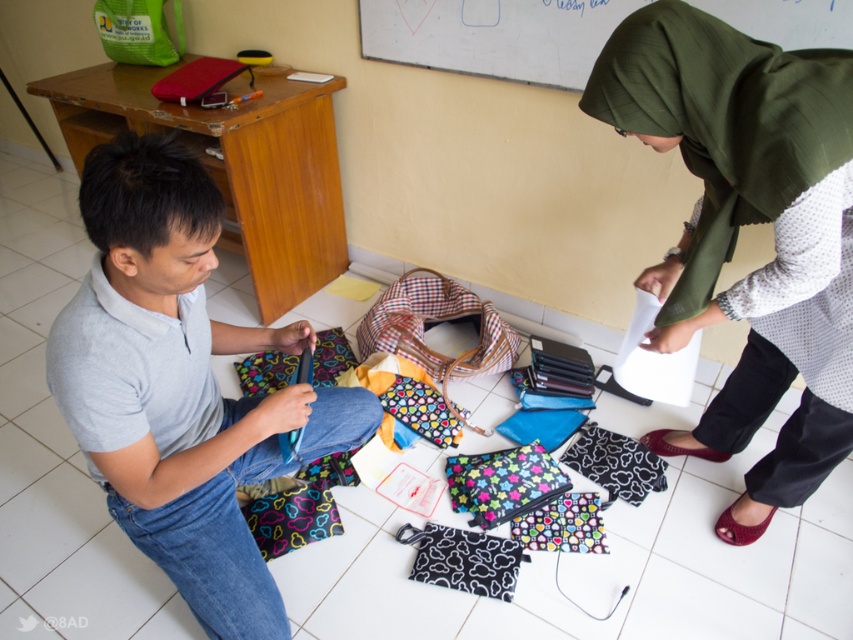
Is green fabric hijab at upper right bigger than gray matte shirt at center?

Correct, green fabric hijab at upper right is larger in size than gray matte shirt at center.

Can you confirm if green fabric hijab at upper right is positioned above gray matte shirt at center?

Yes.

Describe the element at coordinates (747, 224) in the screenshot. I see `green fabric hijab at upper right` at that location.

In order to click on green fabric hijab at upper right in this screenshot , I will do `click(747, 224)`.